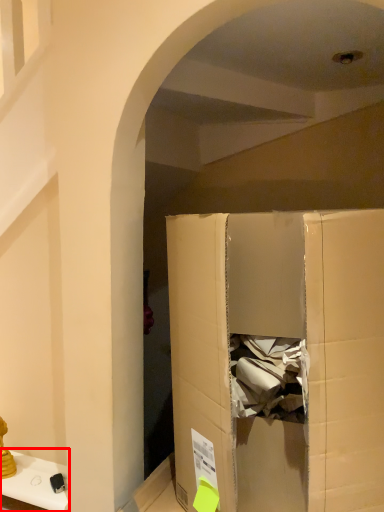
Question: From the image, what is the correct spatial relationship of furniture (annotated by the red box) in relation to cardboard box?

Choices:
 (A) right
 (B) left

Answer: (B)